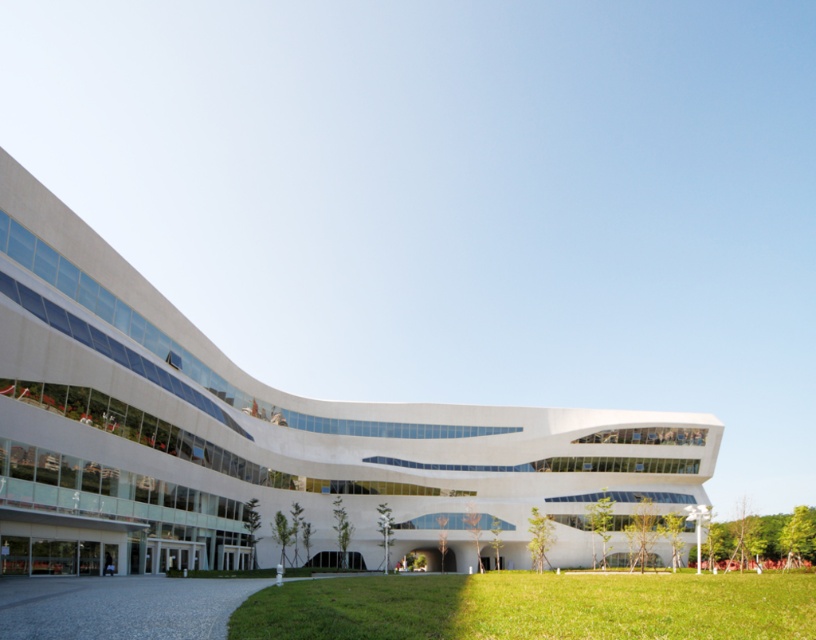
Question: Is white smooth building at center wider than green grass at lower center?

Choices:
 (A) no
 (B) yes

Answer: (B)

Question: Which of the following is the closest to the observer?

Choices:
 (A) (781, 593)
 (B) (329, 435)

Answer: (A)

Question: Does white smooth building at center have a larger size compared to green grass at lower center?

Choices:
 (A) yes
 (B) no

Answer: (A)

Question: Which point appears farthest from the camera in this image?

Choices:
 (A) (623, 522)
 (B) (761, 625)

Answer: (A)

Question: Can you confirm if white smooth building at center is positioned to the right of green grass at lower center?

Choices:
 (A) no
 (B) yes

Answer: (A)

Question: Which object appears farthest from the camera in this image?

Choices:
 (A) white smooth building at center
 (B) green grass at lower center

Answer: (A)